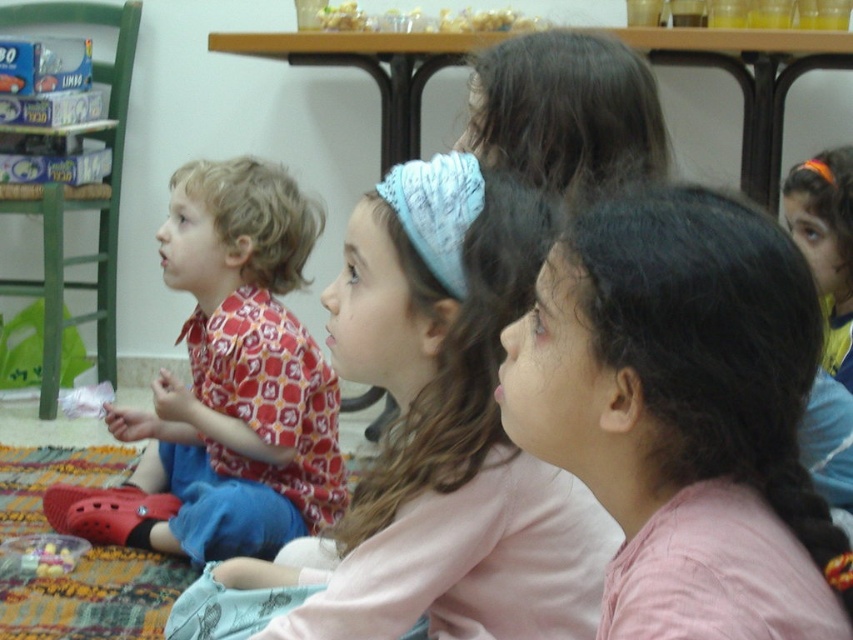
You are a teacher in the classroom. You need to place a new poster on the wall. The poster must be placed between the two points marked as point (689, 394) and point (83, 545). Based on their positions, which point should be closer to the bottom of the poster and which should be closer to the top?

Point (83, 545) should be closer to the bottom of the poster and point (689, 394) closer to the top because point (689, 394) is in front of point (83, 545).

You are a teacher in the classroom and want to place a new small toy on the desk. You have two items available, the light pink fabric headband at center and the plastic toy at lower left. Which item would you choose to place on the desk if you want the smallest object?

The plastic toy at lower left is smaller than the light pink fabric headband at center, so you should choose the plastic toy at lower left to place on the desk.

You are a teacher observing the children in the classroom. You notice the light pink fabric headband at center and the red patterned shirt at left. Which of these two items is closer to the front of the classroom?

The light pink fabric headband at center is shorter than the red patterned shirt at left, so it is closer to the front of the classroom.